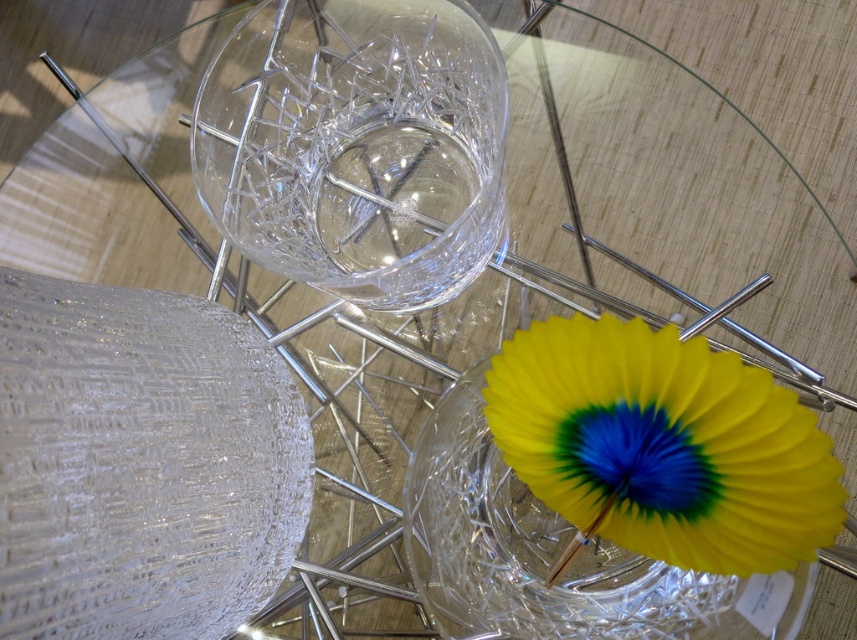
You are trying to place a yellow paper fan at lower right on the table without it overlapping with the transparent crystal vase at upper center. Given their positions and sizes, is this possible?

The transparent crystal vase at upper center might be wider than the yellow paper fan at lower right, so there is a possibility of overlap depending on their exact dimensions and placement. To ensure no overlap, you should check their sizes and adjust their positions accordingly.

You are a guest at a party and want to pick up the yellow paper fan at lower right. Is it possible to reach it without moving the transparent crystal vase at upper center?

The yellow paper fan at lower right is behind the transparent crystal vase at upper center, so you can reach it without moving the vase because it is positioned behind it.

You are standing in front of the glass table and want to place a small decorative item on the table. You have two options for placement points marked as point 1 and point 2. Point 1 is at coordinates point (469, 124) and point 2 is at point (519, 385). Which point is closer to you?

Point 1 is closer to you because it is further to the viewer than point 2.